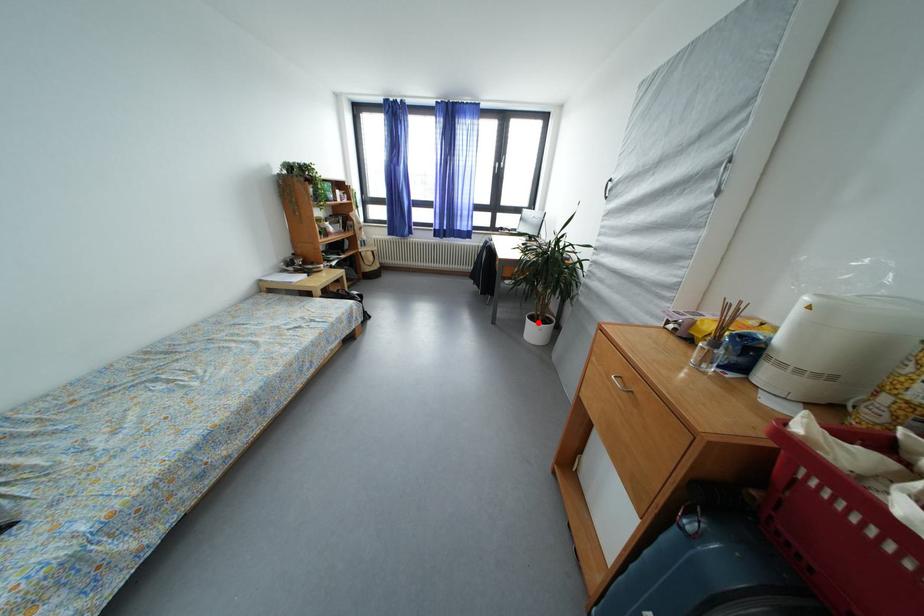
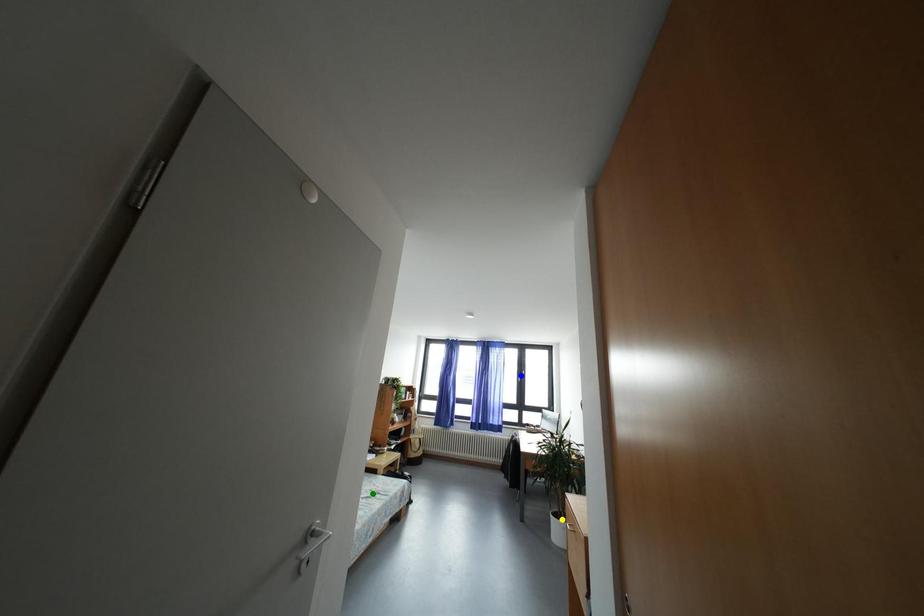
Question: I am providing you with two images of the same scene from different viewpoints. A red point is marked on the first image. You are given multiple points on the second image. Which point in image 2 is actually the same real-world point as the red point in image 1?

Choices:
 (A) yellow point
 (B) green point
 (C) blue point

Answer: (A)